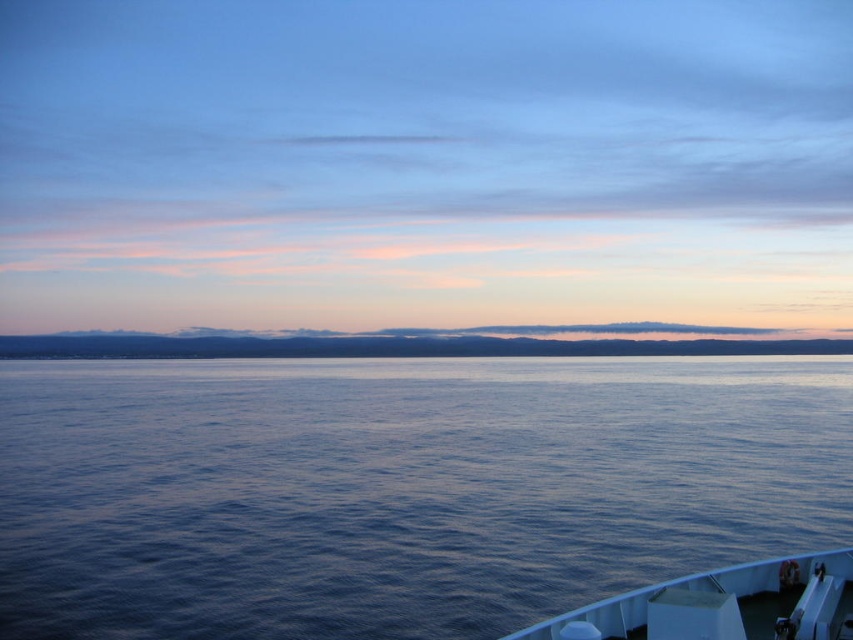
You are standing on a cliff overlooking the sea and see the blue smooth water at center and the white glossy boat at lower right. Which object is closer to the right edge of the image?

The white glossy boat at lower right is closer to the right edge of the image because the blue smooth water at center is positioned on its right side, meaning the boat is to the left of the water and thus not as close to the right edge as the water is.

From the picture: You are standing on a boat in the middle of the sea and notice a specific point in the water. Based on the image provided, what is located at the coordinates point (x=399, y=488)?

At point (x=399, y=488) lies blue smooth water at center.

You are standing on a boat in the middle of the ocean and see the blue smooth water at center and the blue matte horizon at center. Which one is closer to you?

The blue smooth water at center is closer to you because it is in front of the blue matte horizon at center.